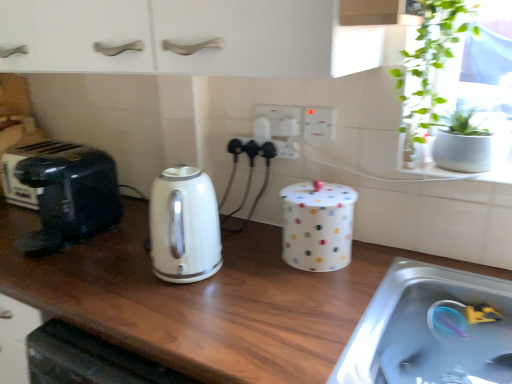
Locate an element on the screen. The width and height of the screenshot is (512, 384). black plastic toaster at left, the second appliance viewed from the front is located at coordinates (28, 158).

What is the approximate height of green leafy plant at upper right?

The height of green leafy plant at upper right is 9.73 inches.

What do you see at coordinates (281, 119) in the screenshot? Image resolution: width=512 pixels, height=384 pixels. I see `white plastic electric outlet at center, the 2th electric outlet positioned from the left` at bounding box center [281, 119].

Locate an element on the screen. The width and height of the screenshot is (512, 384). white plastic electrical outlet at center, the third electric outlet positioned from the left is located at coordinates (319, 123).

Identify the location of white plastic electrical outlet at center, placed as the third electric outlet when sorted from right to left. The width and height of the screenshot is (512, 384). (286, 149).

Identify the location of black plastic toaster at left, which ranks as the 1th appliance in back-to-front order. This screenshot has height=384, width=512. (28, 158).

Considering the relative positions of white polka dot container at center, the first appliance positioned from the right, and wooden at center in the image provided, is white polka dot container at center, the first appliance positioned from the right, to the right of wooden at center from the viewer's perspective?

Yes, white polka dot container at center, the first appliance positioned from the right, is to the right of wooden at center.

From the image's perspective, is white polka dot container at center, the first appliance positioned from the right, under wooden at center?

No.

Is white polka dot container at center, which appears as the 2th appliance when viewed from the left, aimed at wooden at center?

No, white polka dot container at center, which appears as the 2th appliance when viewed from the left, is not aimed at wooden at center.

Is white polka dot container at center, which appears as the 2th appliance when viewed from the left, outside of wooden at center?

That's correct, white polka dot container at center, which appears as the 2th appliance when viewed from the left, is outside of wooden at center.

Is green leafy plant at upper right inside or outside of black plastic toaster at left?

green leafy plant at upper right is located beyond the bounds of black plastic toaster at left.

Is green leafy plant at upper right wider or thinner than black plastic toaster at left?

Considering their sizes, green leafy plant at upper right looks slimmer than black plastic toaster at left.

Can you confirm if green leafy plant at upper right is positioned to the left of black plastic toaster at left?

Incorrect, green leafy plant at upper right is not on the left side of black plastic toaster at left.

Considering the points (435, 67) and (66, 175), which point is in front, point (435, 67) or point (66, 175)?

The point (435, 67) is closer to the camera.

Is point (23, 192) less distant than point (421, 103)?

No, it is behind (421, 103).

From the image's perspective, is black plastic toaster at left, the second appliance viewed from the front, beneath green leafy plant at upper right?

Correct, black plastic toaster at left, the second appliance viewed from the front, appears lower than green leafy plant at upper right in the image.

Between black plastic toaster at left, which ranks as the 1th appliance in back-to-front order, and green leafy plant at upper right, which one has more height?

green leafy plant at upper right.

From the picture: Do you think white glossy electric kettle at center is within black plastic toaster at left, which appears as the second appliance when viewed from the right, or outside of it?

white glossy electric kettle at center cannot be found inside black plastic toaster at left, which appears as the second appliance when viewed from the right.

From the image's perspective, is white glossy electric kettle at center above black plastic toaster at left, the second appliance viewed from the front?

Actually, white glossy electric kettle at center appears below black plastic toaster at left, the second appliance viewed from the front, in the image.

Considering the relative sizes of white glossy electric kettle at center and black plastic toaster at left, the second appliance viewed from the front, in the image provided, is white glossy electric kettle at center thinner than black plastic toaster at left, the second appliance viewed from the front,?

Yes, white glossy electric kettle at center is thinner than black plastic toaster at left, the second appliance viewed from the front.

Is white glossy electric kettle at center smaller than black plastic toaster at left, the second appliance viewed from the front?

Yes.

In the scene shown: Can you see white glossy electric kettle at center touching green leafy plant at upper right?

No, white glossy electric kettle at center is not with green leafy plant at upper right.

Looking at this image, considering the sizes of objects white glossy electric kettle at center and green leafy plant at upper right in the image provided, who is wider, white glossy electric kettle at center or green leafy plant at upper right?

Wider between the two is green leafy plant at upper right.

Is green leafy plant at upper right at the back of white glossy electric kettle at center?

No, green leafy plant at upper right is not at the back of white glossy electric kettle at center.

Identify the location of kitchen appliance on the left side of green leafy plant at upper right. The height and width of the screenshot is (384, 512). (184, 226).

Choose the correct answer: Is white plastic electrical outlet at center, the third electric outlet positioned from the left, inside white plastic electric outlet at center, which is the 2th electric outlet in right-to-left order, or outside it?

white plastic electrical outlet at center, the third electric outlet positioned from the left, is not enclosed by white plastic electric outlet at center, which is the 2th electric outlet in right-to-left order.

In the scene shown: From the image's perspective, who appears lower, white plastic electrical outlet at center, the third electric outlet positioned from the left, or white plastic electric outlet at center, which is the 2th electric outlet in right-to-left order?

white plastic electrical outlet at center, the third electric outlet positioned from the left, appears lower in the image.

Is point (323, 137) behind point (263, 116)?

No, (323, 137) is closer to viewer.

Between white plastic electrical outlet at center, the 1th electric outlet viewed from the right, and white plastic electric outlet at center, the 2th electric outlet positioned from the left, which one appears on the left side from the viewer's perspective?

white plastic electric outlet at center, the 2th electric outlet positioned from the left.

What's the angular difference between white plastic electric outlet at center, the 2th electric outlet positioned from the left, and white glossy electric kettle at center's facing directions?

5.4e-05 degrees separate the facing orientations of white plastic electric outlet at center, the 2th electric outlet positioned from the left, and white glossy electric kettle at center.

Between white plastic electric outlet at center, the 2th electric outlet positioned from the left, and white glossy electric kettle at center, which one has smaller size?

With smaller size is white plastic electric outlet at center, the 2th electric outlet positioned from the left.

From the image's perspective, is white plastic electric outlet at center, which is the 2th electric outlet in right-to-left order, located above or below white glossy electric kettle at center?

white plastic electric outlet at center, which is the 2th electric outlet in right-to-left order, is situated higher than white glossy electric kettle at center in the image.

How far apart are white plastic electric outlet at center, the 2th electric outlet positioned from the left, and white glossy electric kettle at center?

white plastic electric outlet at center, the 2th electric outlet positioned from the left, is 14.66 inches from white glossy electric kettle at center.

Locate an element on the screen. The height and width of the screenshot is (384, 512). countertop on the left side of white polka dot container at center, which appears as the 2th appliance when viewed from the left is located at coordinates (205, 299).

The image size is (512, 384). I want to click on houseplant to the right of black plastic toaster at left, so click(429, 66).

From the image, which object appears to be farther from wooden at center, white polka dot container at center, acting as the first appliance starting from the front, or white glossy electric kettle at center?

white polka dot container at center, acting as the first appliance starting from the front, is further to wooden at center.

From the picture: Based on their spatial positions, is white plastic electric outlet at center, which is the 2th electric outlet in right-to-left order, or black plastic toaster at left further from white glossy electric kettle at center?

white plastic electric outlet at center, which is the 2th electric outlet in right-to-left order, lies further to white glossy electric kettle at center than the other object.

Based on their spatial positions, is white polka dot container at center, acting as the first appliance starting from the front, or white plastic electric outlet at center, the 2th electric outlet positioned from the left, further from black plastic toaster at left?

white polka dot container at center, acting as the first appliance starting from the front, is further to black plastic toaster at left.

When comparing their distances from white plastic electrical outlet at center, which ranks as the first electric outlet in left-to-right order, does wooden at center or white plastic electric outlet at center, which is the 2th electric outlet in right-to-left order, seem further?

wooden at center.

Looking at the image, which one is located further to white plastic electrical outlet at center, the 1th electric outlet viewed from the right, white plastic electric outlet at center, the 2th electric outlet positioned from the left, or black plastic toaster at left, which ranks as the 1th appliance in back-to-front order?

Based on the image, black plastic toaster at left, which ranks as the 1th appliance in back-to-front order, appears to be further to white plastic electrical outlet at center, the 1th electric outlet viewed from the right.

Considering their positions, is white plastic electrical outlet at center, placed as the third electric outlet when sorted from right to left, positioned further to white glossy electric kettle at center than black plastic toaster at left, the second appliance viewed from the front?

black plastic toaster at left, the second appliance viewed from the front, lies further to white glossy electric kettle at center than the other object.

Based on their spatial positions, is white glossy electric kettle at center or white plastic electric outlet at center, the 2th electric outlet positioned from the left, closer to black plastic toaster at left, which ranks as the 1th appliance in back-to-front order?

white glossy electric kettle at center.

Estimate the real-world distances between objects in this image. Which object is closer to white plastic electrical outlet at center, the 1th electric outlet viewed from the right, wooden at center or white polka dot container at center, the first appliance positioned from the right?

white polka dot container at center, the first appliance positioned from the right, lies closer to white plastic electrical outlet at center, the 1th electric outlet viewed from the right, than the other object.

Find the location of a particular element. toaster between black plastic toaster at left, which ranks as the 1th appliance in back-to-front order, and green leafy plant at upper right from left to right is located at coordinates (65, 193).

Find the location of a particular element. The image size is (512, 384). countertop located between black plastic toaster at left and green leafy plant at upper right in the left-right direction is located at coordinates (205, 299).

Locate an element on the screen. Image resolution: width=512 pixels, height=384 pixels. kitchen appliance between black plastic toaster at left and white plastic electrical outlet at center, which ranks as the first electric outlet in left-to-right order, in the horizontal direction is located at coordinates click(x=184, y=226).

Where is `appliance between wooden at center and white plastic electrical outlet at center, which ranks as the first electric outlet in left-to-right order, from front to back`? The height and width of the screenshot is (384, 512). appliance between wooden at center and white plastic electrical outlet at center, which ranks as the first electric outlet in left-to-right order, from front to back is located at coordinates (317, 225).